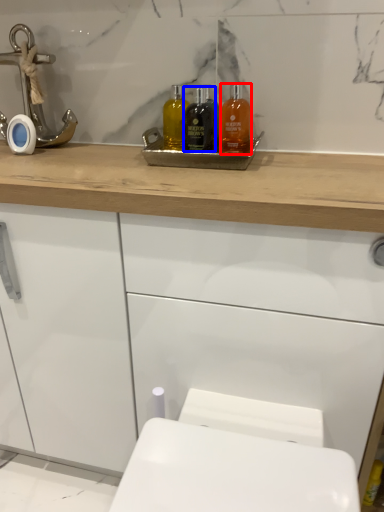
Question: Which object appears farthest to the camera in this image, mouthwash (highlighted by a red box) or mouthwash (highlighted by a blue box)?

Choices:
 (A) mouthwash
 (B) mouthwash

Answer: (B)